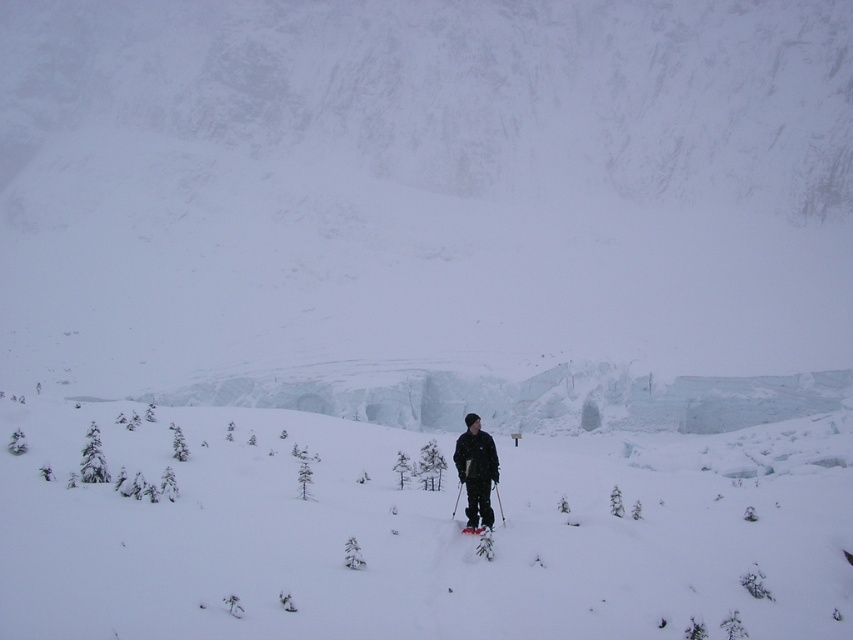
You are a photographer trying to capture the skier in the snowy landscape. You have two skis in the scene, the shiny red ski at center and the white matte ski at center. Which ski should you focus on if you want to highlight the narrower one in your photo?

The shiny red ski at center is thinner than the white matte ski at center, so you should focus on the shiny red ski at center to highlight the narrower one in your photo.

You are a hiker trying to locate your shiny red ski. You are currently at the point marked by the coordinates point [482,540]. Is the shiny red ski at center located in front of or behind you?

The shiny red ski at center is located at the coordinates point [482,540], so it is exactly where you are standing.

You are a photographer planning to take a closeup shot of the white fluffy snow at center and the white matte ski at center. Which object will appear larger in the photo?

The white fluffy snow at center will appear larger in the photo because it is taller than the white matte ski at center.